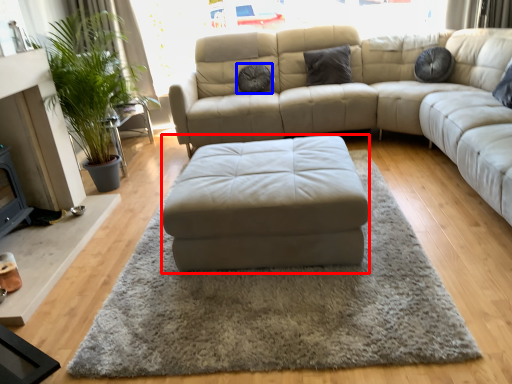
Question: Which object is further to the camera taking this photo, footrest (highlighted by a red box) or pillow (highlighted by a blue box)?

Choices:
 (A) footrest
 (B) pillow

Answer: (B)